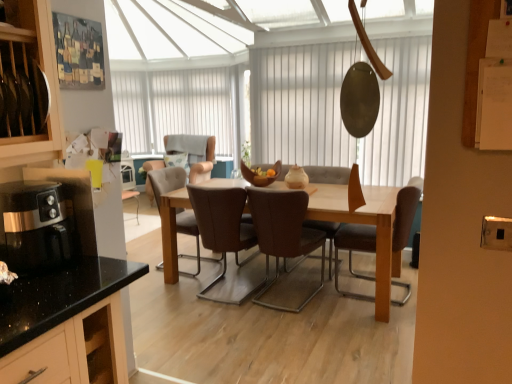
Question: From the image's perspective, is brown leather chair at center, which is the 2th chair from front to back, located above black glossy coffee machine at left?

Choices:
 (A) no
 (B) yes

Answer: (A)

Question: From a real-world perspective, is brown leather chair at center, the 5th chair when ordered from back to front, positioned under black glossy coffee machine at left based on gravity?

Choices:
 (A) yes
 (B) no

Answer: (A)

Question: Is brown leather chair at center, which is the 2th chair from front to back, looking in the opposite direction of black glossy coffee machine at left?

Choices:
 (A) yes
 (B) no

Answer: (B)

Question: Considering the relative sizes of brown leather chair at center, which is the 2th chair from front to back, and black glossy coffee machine at left in the image provided, is brown leather chair at center, which is the 2th chair from front to back, taller than black glossy coffee machine at left?

Choices:
 (A) yes
 (B) no

Answer: (A)

Question: From a real-world perspective, is brown leather chair at center, the 5th chair when ordered from back to front, on black glossy coffee machine at left?

Choices:
 (A) yes
 (B) no

Answer: (B)

Question: Is point (307, 168) positioned closer to the camera than point (224, 236)?

Choices:
 (A) closer
 (B) farther

Answer: (B)

Question: Do you think brown leather chair at center, acting as the 4th chair starting from the front, is within brown leather chair at center, marked as the 3th chair in a front-to-back arrangement, or outside of it?

Choices:
 (A) inside
 (B) outside

Answer: (B)

Question: Looking at their shapes, would you say brown leather chair at center, marked as the third chair in a back-to-front arrangement, is wider or thinner than brown leather chair at center, which is the 4th chair in back-to-front order?

Choices:
 (A) wide
 (B) thin

Answer: (B)

Question: From the image's perspective, is brown leather chair at center, acting as the 4th chair starting from the front, located above or below brown leather chair at center, which is the 4th chair in back-to-front order?

Choices:
 (A) above
 (B) below

Answer: (A)

Question: From the image's perspective, is brown leather chair at center, acting as the first chair starting from the front, above or below white vertical blinds at upper center, which is the 2th window screen from right to left?

Choices:
 (A) above
 (B) below

Answer: (B)

Question: Would you say brown leather chair at center, arranged as the 6th chair when viewed from the back, is to the left or to the right of white vertical blinds at upper center, the 1th window screen in the left-to-right sequence, in the picture?

Choices:
 (A) right
 (B) left

Answer: (A)

Question: Choose the correct answer: Is brown leather chair at center, arranged as the 6th chair when viewed from the back, inside white vertical blinds at upper center, which is the 2th window screen from right to left, or outside it?

Choices:
 (A) outside
 (B) inside

Answer: (A)

Question: In terms of height, does brown leather chair at center, arranged as the 6th chair when viewed from the back, look taller or shorter compared to white vertical blinds at upper center, which is counted as the second window screen, starting from the front?

Choices:
 (A) short
 (B) tall

Answer: (A)

Question: From the image's perspective, relative to brown leather chair at center, which is the 4th chair in back-to-front order, is brown leather chair at center, arranged as the 6th chair when viewed from the back, above or below?

Choices:
 (A) above
 (B) below

Answer: (B)

Question: Which is correct: brown leather chair at center, acting as the first chair starting from the front, is inside brown leather chair at center, which is the 4th chair in back-to-front order, or outside of it?

Choices:
 (A) outside
 (B) inside

Answer: (A)